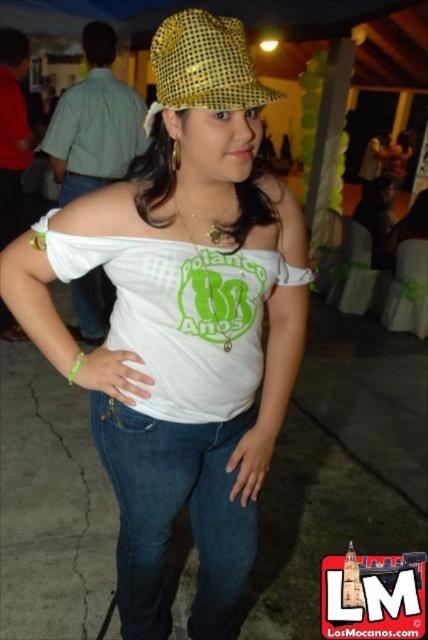
You are a photographer at the event and want to capture a photo of the matte gold hat at upper center without the denim at left appearing in the background. Is this possible based on their positions?

Yes, since the matte gold hat at upper center is in front of the denim at left, positioning the camera to focus on the matte gold hat at upper center while ensuring the denim at left is out of frame would achieve this.

You are at the event and want to move from the point at coordinates point (x=175, y=412) to the point at coordinates point (x=124, y=438). Can you walk directly between them without any obstacles?

Point (x=175, y=412) is in front of point (x=124, y=438), so you can walk directly between them without any obstacles.